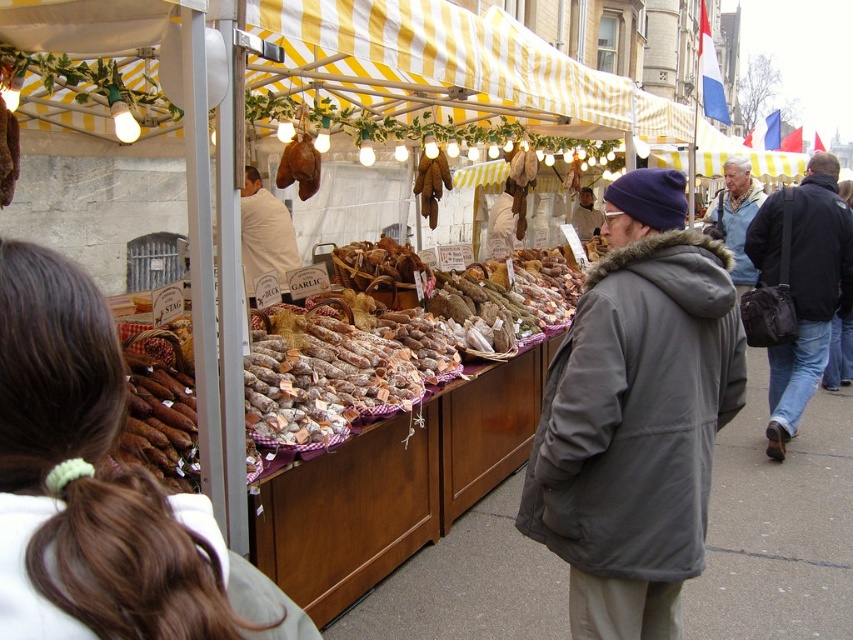
Consider the image. Who is more forward, (254, 211) or (589, 224)?

Point (254, 211)

Who is more distant from viewer, [263,195] or [579,202]?

The point [579,202] is behind.

This screenshot has height=640, width=853. In order to click on white clothed man at center in this screenshot , I will do `click(265, 236)`.

Does brown leather bag at center appear on the right side of brown leather gloves at center?

No, brown leather bag at center is not to the right of brown leather gloves at center.

This screenshot has height=640, width=853. Describe the element at coordinates (299, 164) in the screenshot. I see `brown leather bag at center` at that location.

This screenshot has width=853, height=640. Describe the element at coordinates (299, 164) in the screenshot. I see `brown leather bag at center` at that location.

I want to click on brown leather bag at center, so click(299, 164).

Does brown leather bag at center appear over matte gray coat at center?

No.

Does brown leather bag at center lie in front of matte gray coat at center?

Yes, brown leather bag at center is in front of matte gray coat at center.

Identify the location of brown leather bag at center. The image size is (853, 640). (299, 164).